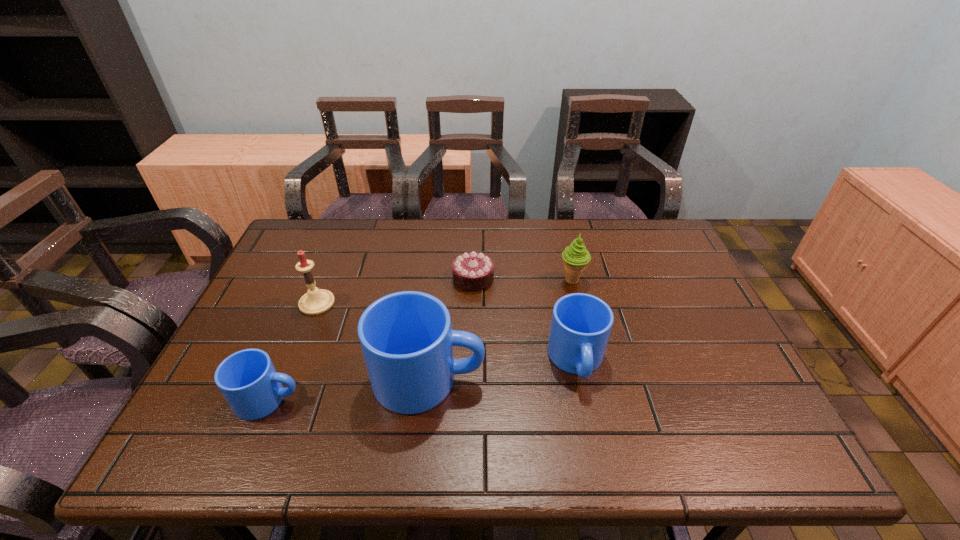
Image resolution: width=960 pixels, height=540 pixels. In order to click on the leftmost mug in this screenshot , I will do `click(247, 379)`.

Find the location of a particular element. Image resolution: width=960 pixels, height=540 pixels. the shortest mug is located at coordinates (247, 379).

This screenshot has height=540, width=960. I want to click on the second mug from left to right, so click(406, 337).

At what (x,y) coordinates should I click in order to perform the action: click on the second tallest mug. Please return your answer as a coordinate pair (x, y). Looking at the image, I should click on (581, 323).

What are the coordinates of `the third shortest object` in the screenshot? It's located at (581, 323).

At what (x,y) coordinates should I click in order to perform the action: click on candle. Please return your answer as a coordinate pair (x, y). The image size is (960, 540). Looking at the image, I should click on (316, 301).

The image size is (960, 540). I want to click on the shortest object, so click(x=472, y=271).

Find the location of a particular element. icecream is located at coordinates (576, 256).

Locate an element on the screen. vacant region located on the side of the shortest mug with the handle is located at coordinates (421, 399).

Locate an element on the screen. This screenshot has width=960, height=540. free region located 0.270m on the side of the tallest mug with the handle is located at coordinates (600, 379).